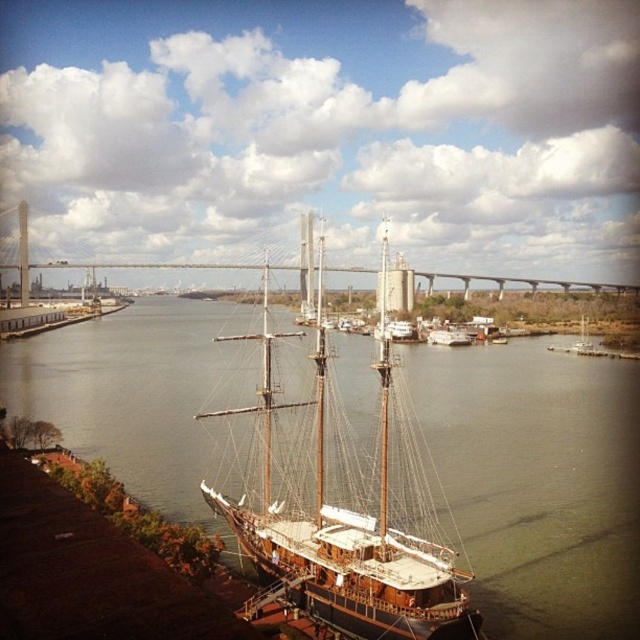
Question: Which of the following is the closest to the observer?

Choices:
 (A) wooden sailboat at center
 (B) wooden ship at center

Answer: (A)

Question: Can you confirm if wooden sailboat at center is positioned to the right of concrete bridge at center?

Choices:
 (A) yes
 (B) no

Answer: (B)

Question: Is wooden sailboat at center positioned behind concrete bridge at center?

Choices:
 (A) no
 (B) yes

Answer: (A)

Question: Among these objects, which one is farthest from the camera?

Choices:
 (A) wooden ship at center
 (B) concrete bridge at center

Answer: (B)

Question: Does wooden sailboat at center have a lesser width compared to wooden ship at center?

Choices:
 (A) yes
 (B) no

Answer: (B)

Question: Which of the following is the closest to the observer?

Choices:
 (A) brown wooden ship at center
 (B) wooden ship at center

Answer: (A)